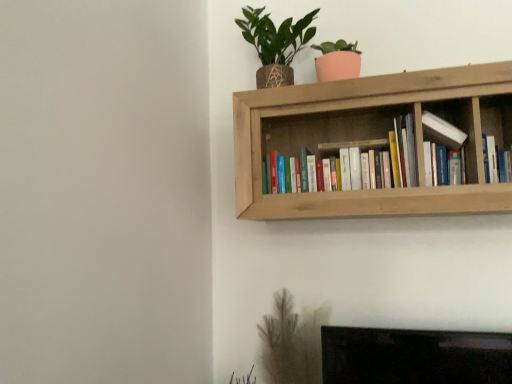
Question: Should I look upward or downward to see hardcover books at center, arranged as the second book when viewed from the right?

Choices:
 (A) up
 (B) down

Answer: (A)

Question: Is green leafy plant in woven pot at upper right further to the viewer compared to natural wood bookshelf at upper center?

Choices:
 (A) yes
 (B) no

Answer: (A)

Question: Considering the relative sizes of green leafy plant in woven pot at upper right and natural wood bookshelf at upper center in the image provided, is green leafy plant in woven pot at upper right bigger than natural wood bookshelf at upper center?

Choices:
 (A) yes
 (B) no

Answer: (B)

Question: Considering the relative positions of green leafy plant in woven pot at upper right and natural wood bookshelf at upper center in the image provided, is green leafy plant in woven pot at upper right to the right of natural wood bookshelf at upper center from the viewer's perspective?

Choices:
 (A) no
 (B) yes

Answer: (A)

Question: From the image's perspective, is green leafy plant in woven pot at upper right located beneath natural wood bookshelf at upper center?

Choices:
 (A) no
 (B) yes

Answer: (A)

Question: Is green leafy plant in woven pot at upper right positioned in front of natural wood bookshelf at upper center?

Choices:
 (A) no
 (B) yes

Answer: (A)

Question: Is green leafy plant in woven pot at upper right outside natural wood bookshelf at upper center?

Choices:
 (A) no
 (B) yes

Answer: (B)

Question: Is hardcover books at center, the 1th book viewed from the left, in contact with green leafy plant in woven pot at upper right?

Choices:
 (A) yes
 (B) no

Answer: (B)

Question: Can you confirm if hardcover books at center, the 1th book viewed from the left, is thinner than green leafy plant in woven pot at upper right?

Choices:
 (A) yes
 (B) no

Answer: (A)

Question: Is hardcover books at center, the 1th book viewed from the left, outside of green leafy plant in woven pot at upper right?

Choices:
 (A) yes
 (B) no

Answer: (A)

Question: From a real-world perspective, is hardcover books at center, arranged as the second book when viewed from the right, located higher than green leafy plant in woven pot at upper right?

Choices:
 (A) no
 (B) yes

Answer: (A)

Question: Is hardcover books at center, arranged as the second book when viewed from the right, to the left of green leafy plant in woven pot at upper right from the viewer's perspective?

Choices:
 (A) yes
 (B) no

Answer: (B)

Question: From a real-world perspective, does hardcover books at center, arranged as the second book when viewed from the right, sit lower than green leafy plant in woven pot at upper right?

Choices:
 (A) no
 (B) yes

Answer: (B)

Question: Are hardcover books at center, the 1th book viewed from the left, and hardcover book at upper right, which is counted as the 1th book, starting from the right, far apart?

Choices:
 (A) no
 (B) yes

Answer: (A)